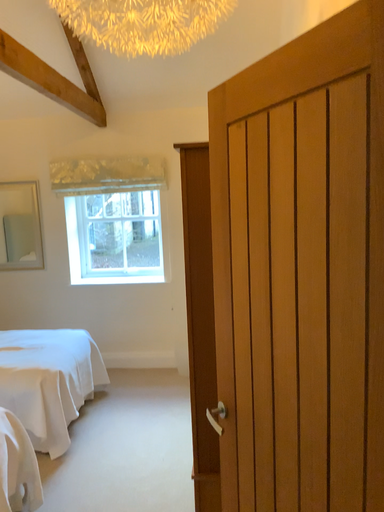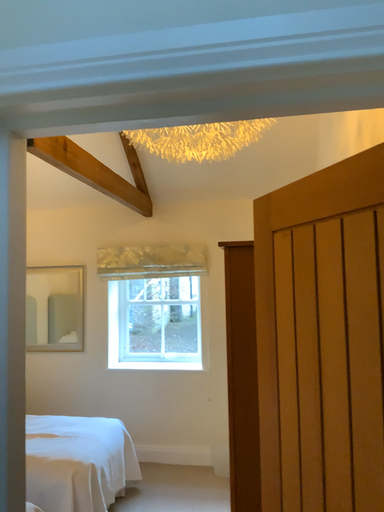
Question: How did the camera likely rotate when shooting the video?

Choices:
 (A) rotated downward
 (B) rotated upward

Answer: (B)